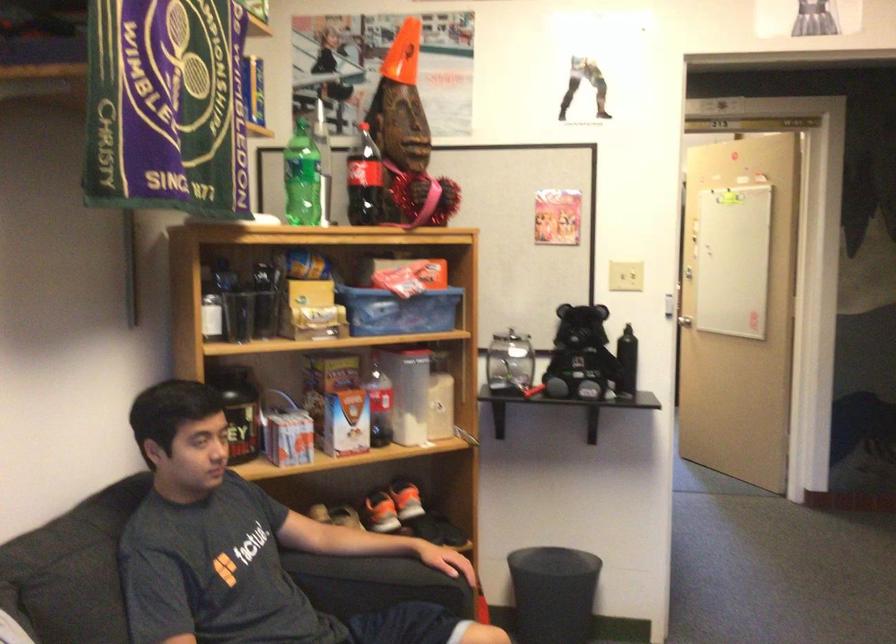
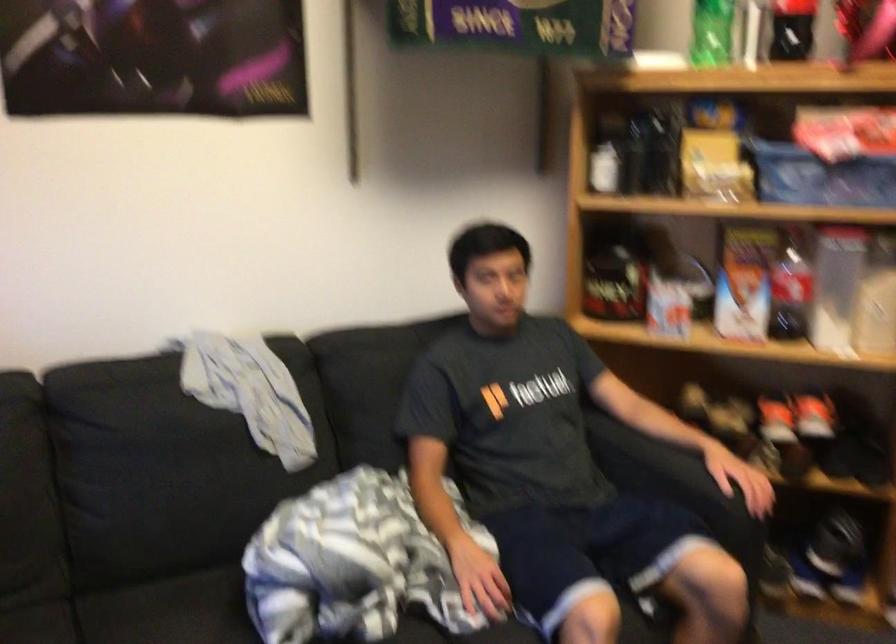
In the second image, find the point that corresponds to the point at 212,299 in the first image.

(607, 154)